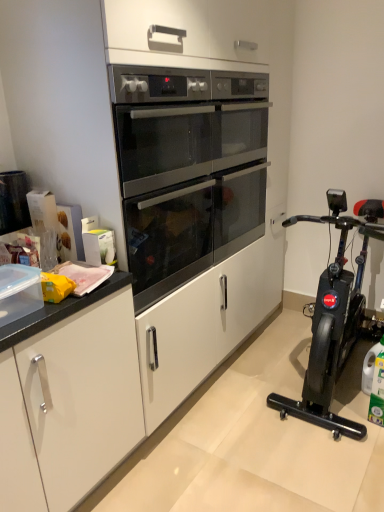
Question: Would you say satin black oven at center is a long distance from black plastic exercise bike at right?

Choices:
 (A) yes
 (B) no

Answer: (B)

Question: Is satin black oven at center oriented away from black plastic exercise bike at right?

Choices:
 (A) yes
 (B) no

Answer: (B)

Question: Does satin black oven at center touch black plastic exercise bike at right?

Choices:
 (A) no
 (B) yes

Answer: (A)

Question: Can you confirm if satin black oven at center is shorter than black plastic exercise bike at right?

Choices:
 (A) no
 (B) yes

Answer: (B)

Question: Would you say satin black oven at center contains black plastic exercise bike at right?

Choices:
 (A) no
 (B) yes

Answer: (A)

Question: Is satin black oven at center outside of black plastic exercise bike at right?

Choices:
 (A) yes
 (B) no

Answer: (A)

Question: Can you confirm if black plastic exercise bike at right is shorter than satin black oven at center?

Choices:
 (A) yes
 (B) no

Answer: (B)

Question: From a real-world perspective, is black plastic exercise bike at right under satin black oven at center?

Choices:
 (A) no
 (B) yes

Answer: (B)

Question: Considering the relative sizes of black plastic exercise bike at right and satin black oven at center in the image provided, is black plastic exercise bike at right bigger than satin black oven at center?

Choices:
 (A) no
 (B) yes

Answer: (B)

Question: Does black plastic exercise bike at right turn towards satin black oven at center?

Choices:
 (A) yes
 (B) no

Answer: (B)

Question: Is black plastic exercise bike at right touching satin black oven at center?

Choices:
 (A) no
 (B) yes

Answer: (A)

Question: Can you confirm if black plastic exercise bike at right is positioned to the left of satin black oven at center?

Choices:
 (A) no
 (B) yes

Answer: (A)

Question: Is point (153, 252) closer or farther from the camera than point (269, 400)?

Choices:
 (A) closer
 (B) farther

Answer: (A)